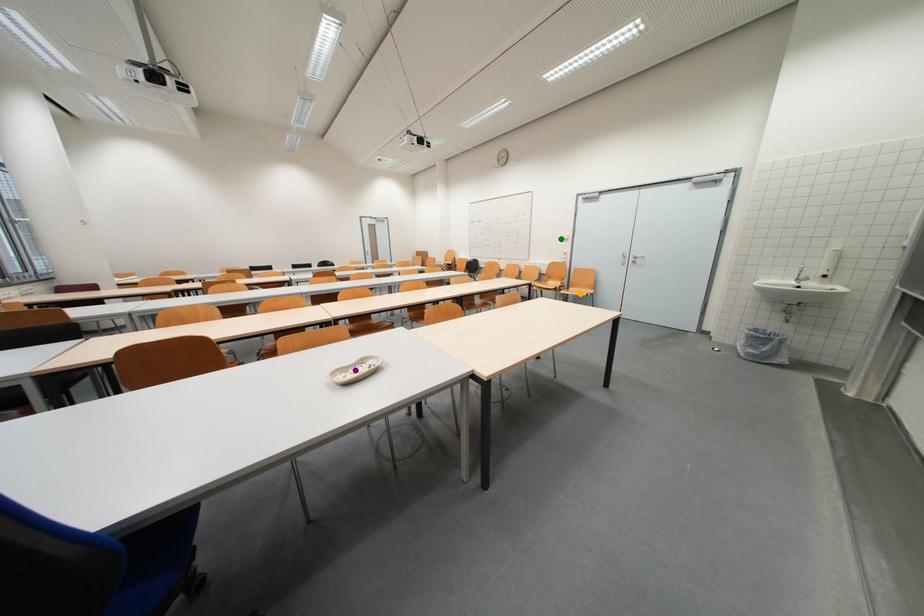
Based on the photo, order these from nearest to farthest:
1. purple point
2. orange point
3. green point

green point < orange point < purple point